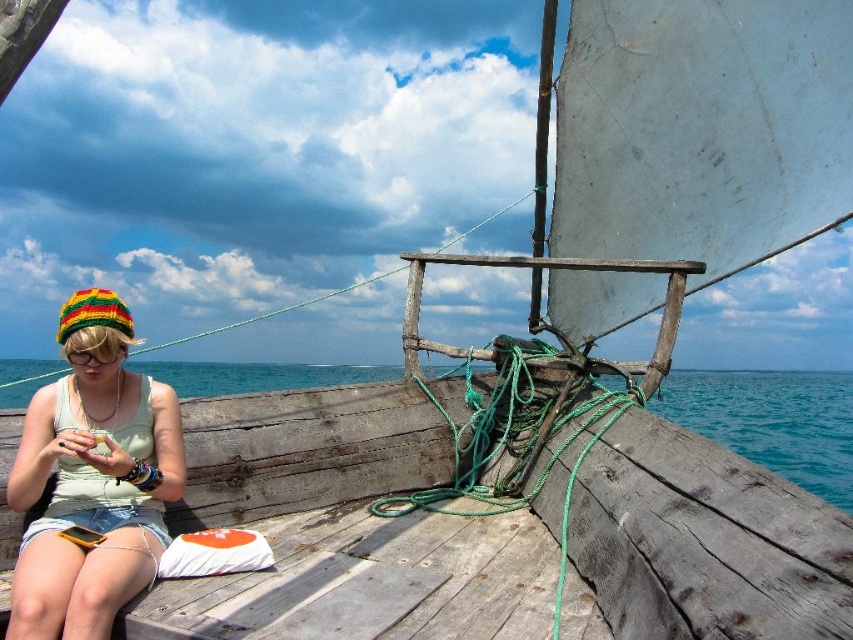
Can you confirm if blue water at lower left is bigger than clear plastic goggles at left?

Correct, blue water at lower left is larger in size than clear plastic goggles at left.

Can you confirm if blue water at lower left is wider than clear plastic goggles at left?

Yes.

The image size is (853, 640). I want to click on blue water at lower left, so click(x=770, y=420).

Between knitted multicolored hat at left and clear plastic goggles at left, which one has less height?

Standing shorter between the two is clear plastic goggles at left.

Can you confirm if knitted multicolored hat at left is positioned below clear plastic goggles at left?

Correct, knitted multicolored hat at left is located below clear plastic goggles at left.

Does point (44, 564) come farther from viewer compared to point (73, 358)?

No, (44, 564) is closer to viewer.

Locate an element on the screen. The width and height of the screenshot is (853, 640). knitted multicolored hat at left is located at coordinates (91, 499).

Measure the distance from knitted multicolored hat at left to blue water at lower left.

They are 10.13 meters apart.

Which is in front, point (117, 344) or point (788, 401)?

Point (117, 344)

Is point (143, 426) closer to camera compared to point (250, 387)?

Yes, point (143, 426) is closer to viewer.

Image resolution: width=853 pixels, height=640 pixels. Find the location of `knitted multicolored hat at left`. knitted multicolored hat at left is located at coordinates (91, 499).